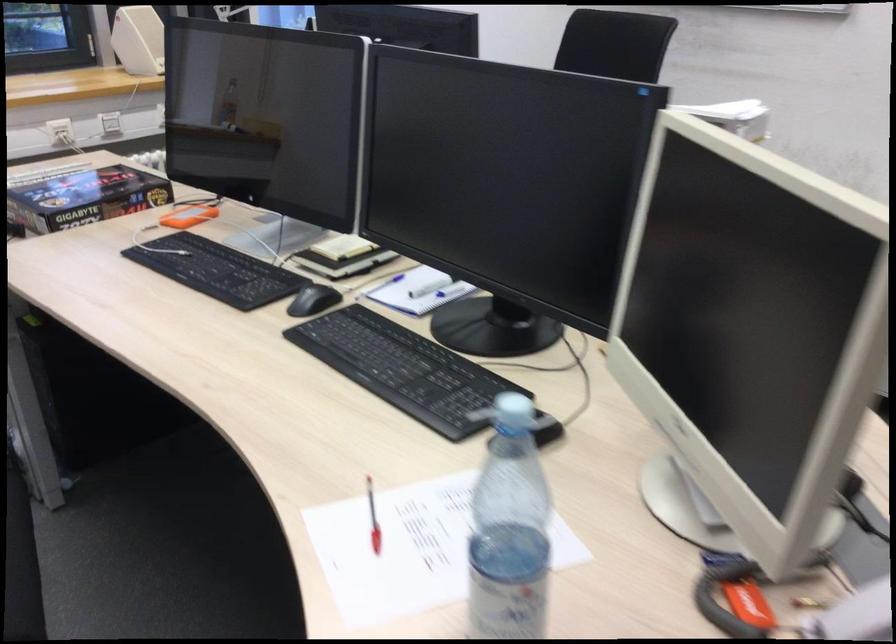
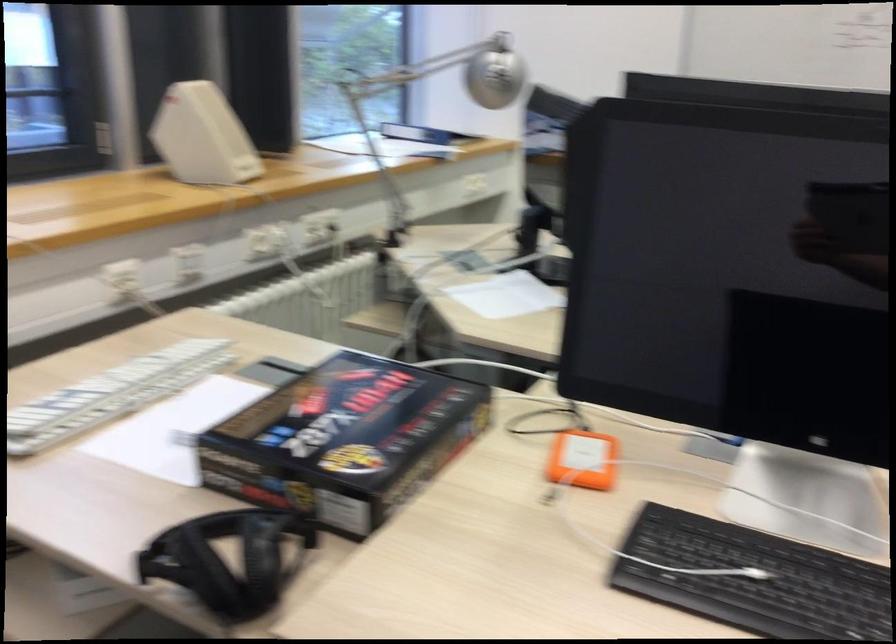
In the second image, find the point that corresponds to (x=183, y=259) in the first image.

(754, 579)